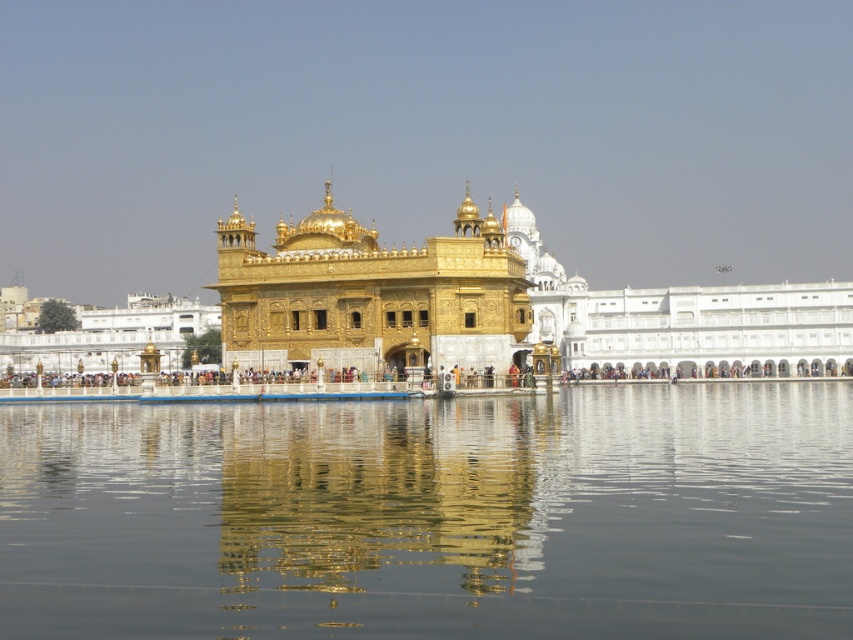
Is transparent liquid water at center to the right of gold shiny palace at center from the viewer's perspective?

No, transparent liquid water at center is not to the right of gold shiny palace at center.

Which is more to the left, transparent liquid water at center or gold shiny palace at center?

transparent liquid water at center

Where is `transparent liquid water at center`? The height and width of the screenshot is (640, 853). transparent liquid water at center is located at coordinates (434, 515).